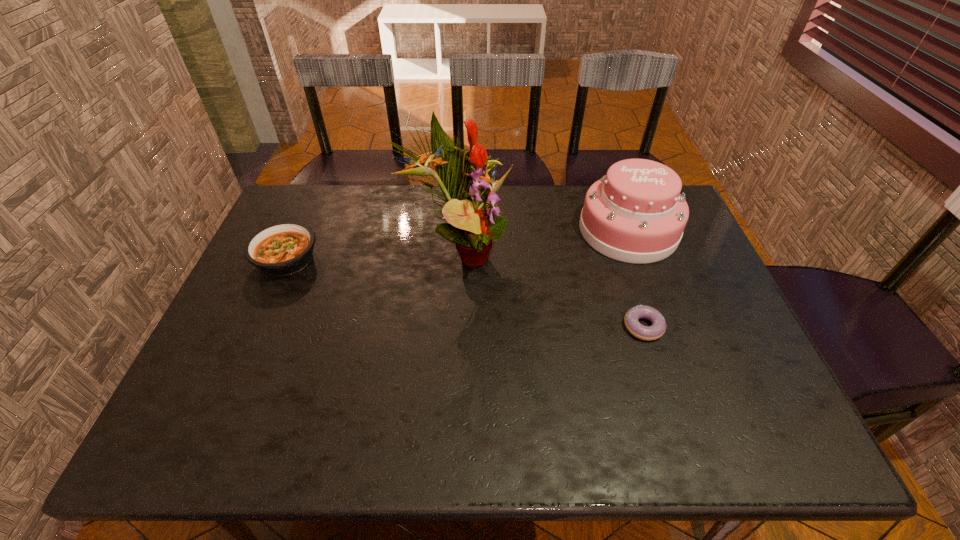
Identify the location of blank space at the near right corner of the desktop. (797, 451).

Where is `free point between the third object from right to left and the leftmost object`? The image size is (960, 540). free point between the third object from right to left and the leftmost object is located at coordinates (372, 256).

You are a GUI agent. You are given a task and a screenshot of the screen. Output one action in this format:
    pyautogui.click(x=<x>, y=<y>)
    Task: Click on the empty location between the shortest object and the leftmost object
    
    Given the screenshot: What is the action you would take?
    pyautogui.click(x=465, y=293)

Identify the location of empty space between the doughnut and the tallest object. (551, 289).

Where is `free space between the nearest object and the third tallest object`? The image size is (960, 540). free space between the nearest object and the third tallest object is located at coordinates (465, 293).

What are the coordinates of `free space between the shortest object and the tallest object` in the screenshot? It's located at (551, 289).

Locate an element on the screen. This screenshot has height=540, width=960. free spot between the shortest object and the second tallest object is located at coordinates (636, 279).

Identify the location of vacant space in between the nearest object and the leftmost object. This screenshot has height=540, width=960. click(465, 293).

Locate an element on the screen. vacant point located between the leftmost object and the tallest object is located at coordinates (372, 256).

Locate an element on the screen. The image size is (960, 540). object that can be found as the third closest to the leftmost object is located at coordinates (631, 320).